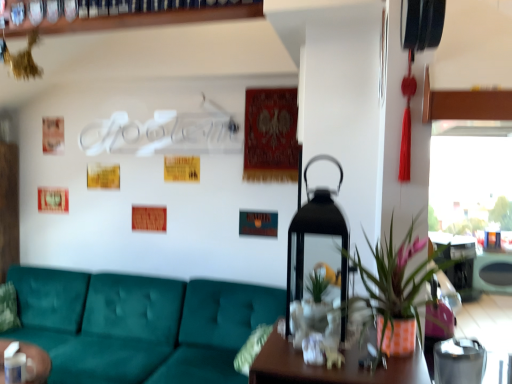
Question: Is transparent glass window at upper right smaller than orange textured pot at center?

Choices:
 (A) yes
 (B) no

Answer: (A)

Question: From the image's perspective, is transparent glass window at upper right on orange textured pot at center?

Choices:
 (A) yes
 (B) no

Answer: (A)

Question: Can you confirm if transparent glass window at upper right is thinner than orange textured pot at center?

Choices:
 (A) yes
 (B) no

Answer: (A)

Question: Is transparent glass window at upper right at the right side of orange textured pot at center?

Choices:
 (A) yes
 (B) no

Answer: (A)

Question: From a real-world perspective, is transparent glass window at upper right below orange textured pot at center?

Choices:
 (A) yes
 (B) no

Answer: (B)

Question: Is teal fabric couch at lower left in front of or behind transparent glass window at upper right in the image?

Choices:
 (A) behind
 (B) front

Answer: (B)

Question: From the image's perspective, relative to transparent glass window at upper right, is teal fabric couch at lower left above or below?

Choices:
 (A) below
 (B) above

Answer: (A)

Question: From a real-world perspective, is teal fabric couch at lower left above or below transparent glass window at upper right?

Choices:
 (A) above
 (B) below

Answer: (B)

Question: Is teal fabric couch at lower left wider or thinner than transparent glass window at upper right?

Choices:
 (A) thin
 (B) wide

Answer: (B)

Question: In terms of size, does orange textured pot at center appear bigger or smaller than wooden table at right?

Choices:
 (A) small
 (B) big

Answer: (B)

Question: Is point (409, 319) closer or farther from the camera than point (470, 238)?

Choices:
 (A) farther
 (B) closer

Answer: (B)

Question: Considering the positions of orange textured pot at center and wooden table at right in the image, is orange textured pot at center wider or thinner than wooden table at right?

Choices:
 (A) wide
 (B) thin

Answer: (A)

Question: From a real-world perspective, is orange textured pot at center physically located above or below wooden table at right?

Choices:
 (A) below
 (B) above

Answer: (B)

Question: From their relative heights in the image, would you say wooden table at right is taller or shorter than teal fabric couch at lower left?

Choices:
 (A) short
 (B) tall

Answer: (A)

Question: In terms of width, does wooden table at right look wider or thinner when compared to teal fabric couch at lower left?

Choices:
 (A) thin
 (B) wide

Answer: (A)